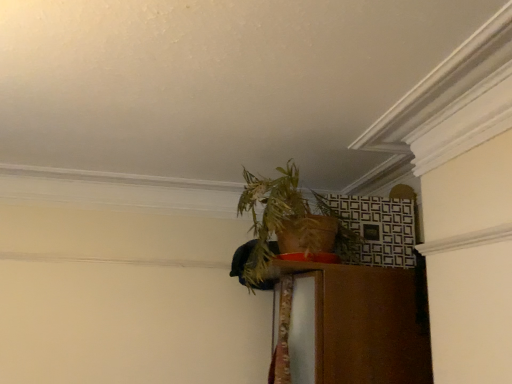
Image resolution: width=512 pixels, height=384 pixels. What do you see at coordinates (285, 225) in the screenshot?
I see `green leafy plant at upper center` at bounding box center [285, 225].

Find the location of a particular element. This screenshot has height=384, width=512. green leafy plant at upper center is located at coordinates (285, 225).

You are a GUI agent. You are given a task and a screenshot of the screen. Output one action in this format:
    pyautogui.click(x=<x>, y=<y>)
    Task: Click on the green leafy plant at upper center
    
    Given the screenshot: What is the action you would take?
    pyautogui.click(x=285, y=225)